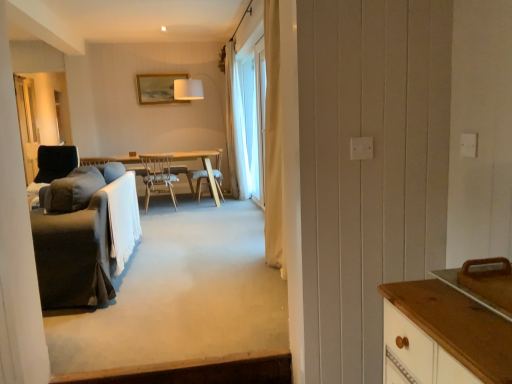
Question: Would you say black fabric screen door at left is to the left or to the right of white sheer curtain at center in the picture?

Choices:
 (A) left
 (B) right

Answer: (A)

Question: Relative to white sheer curtain at center, is black fabric screen door at left in front or behind?

Choices:
 (A) front
 (B) behind

Answer: (B)

Question: Which of these objects is positioned farthest from the wooden chair at center, which is the second chair from right to left?

Choices:
 (A) white sheer curtain at center
 (B) white sheer curtain at center
 (C) wooden frame at upper center
 (D) white sheer curtain at upper center
 (E) light wood table at center

Answer: (A)

Question: Which object is the farthest from the wooden chair at center, placed as the second chair when sorted from left to right?

Choices:
 (A) dark gray fabric couch at left
 (B) white sheer curtain at center
 (C) white sheer curtain at upper center
 (D) soft gray carpet at center
 (E) light wood table at center

Answer: (A)